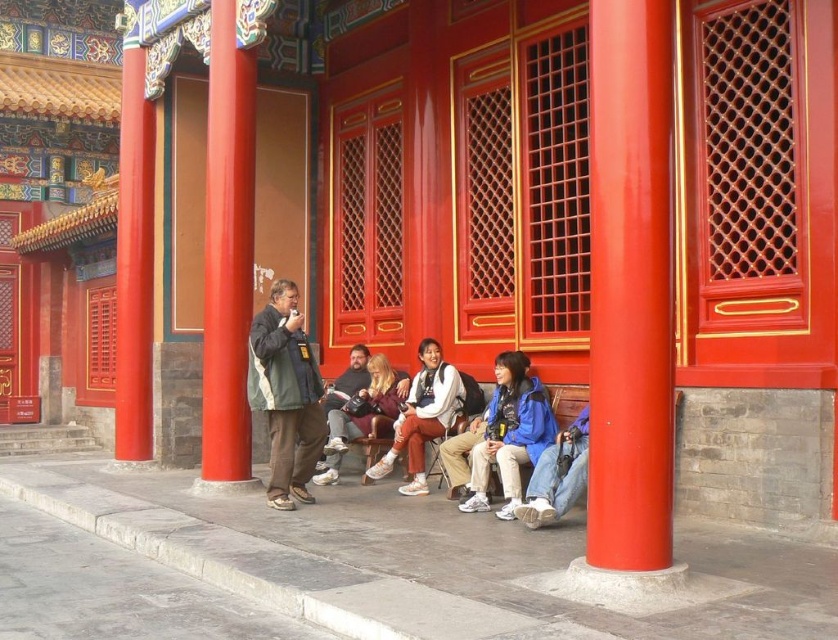
Which is behind, point (666, 538) or point (480, 422)?

The point (480, 422) is more distant.

Who is more forward, (616,412) or (464,500)?

Positioned in front is point (616,412).

Between point (642, 243) and point (503, 435), which one is positioned behind?

Positioned behind is point (503, 435).

What are the coordinates of `glossy red pillar at center` in the screenshot? It's located at pos(629,285).

This screenshot has height=640, width=838. What do you see at coordinates (133, 252) in the screenshot?
I see `smooth red pillar at upper left` at bounding box center [133, 252].

Between smooth red pillar at upper left and white leather sneakers at center, which one has less height?

With less height is white leather sneakers at center.

Locate an element on the screen. smooth red pillar at upper left is located at coordinates (133, 252).

Based on the photo, is white fabric jacket at center to the right of blue denim jeans at lower right from the viewer's perspective?

Incorrect, white fabric jacket at center is not on the right side of blue denim jeans at lower right.

Can you confirm if white fabric jacket at center is taller than blue denim jeans at lower right?

Indeed, white fabric jacket at center has a greater height compared to blue denim jeans at lower right.

Which is behind, point (410, 474) or point (561, 490)?

The point (410, 474) is more distant.

The width and height of the screenshot is (838, 640). I want to click on white fabric jacket at center, so click(422, 417).